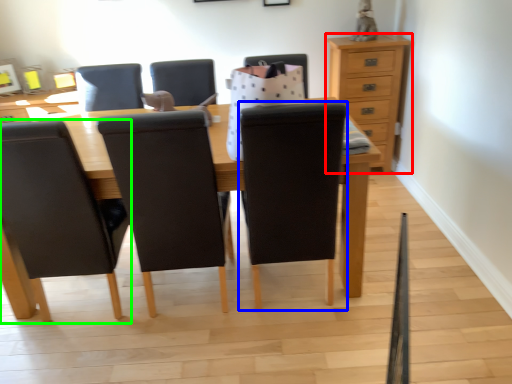
Question: Which is farther away from chest of drawers (highlighted by a red box)? chair (highlighted by a blue box) or chair (highlighted by a green box)?

Choices:
 (A) chair
 (B) chair

Answer: (B)